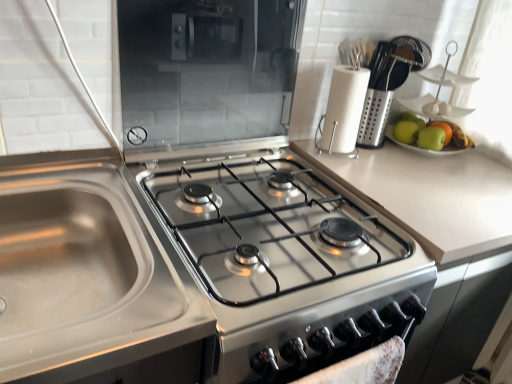
Find the location of a particular element. This screenshot has width=512, height=384. vacant area that is in front of green matte apple at upper right, which ranks as the 1th apple in left-to-right order is located at coordinates (415, 164).